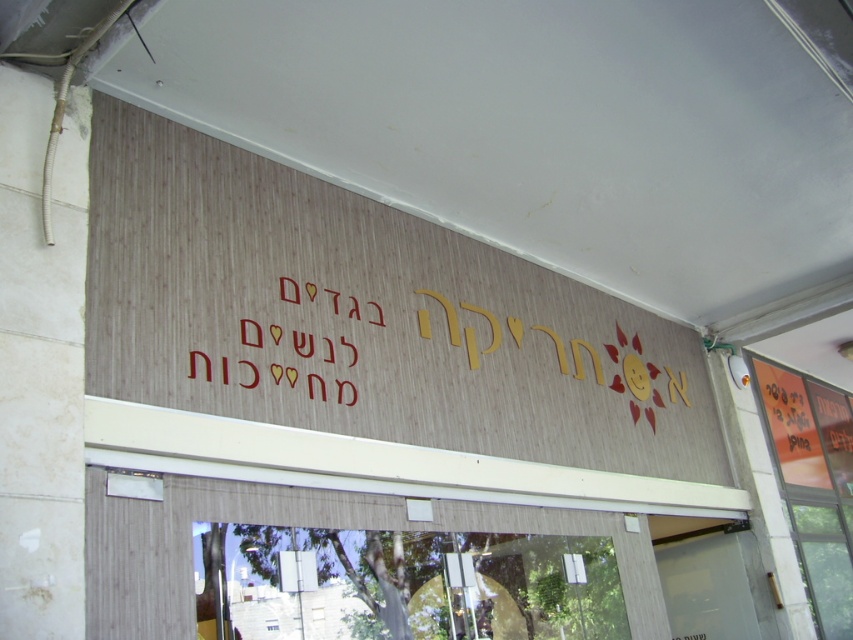
Question: Which object appears farthest from the camera in this image?

Choices:
 (A) wooden signboard at upper center
 (B) transparent glass door at lower center

Answer: (B)

Question: Does wooden signboard at upper center appear under transparent glass door at lower center?

Choices:
 (A) no
 (B) yes

Answer: (A)

Question: Can you confirm if wooden signboard at upper center is smaller than transparent glass door at lower center?

Choices:
 (A) no
 (B) yes

Answer: (A)

Question: Which point is closer to the camera?

Choices:
 (A) transparent glass door at lower center
 (B) wooden signboard at upper center

Answer: (B)

Question: Is wooden signboard at upper center further to the viewer compared to transparent glass door at lower center?

Choices:
 (A) yes
 (B) no

Answer: (B)